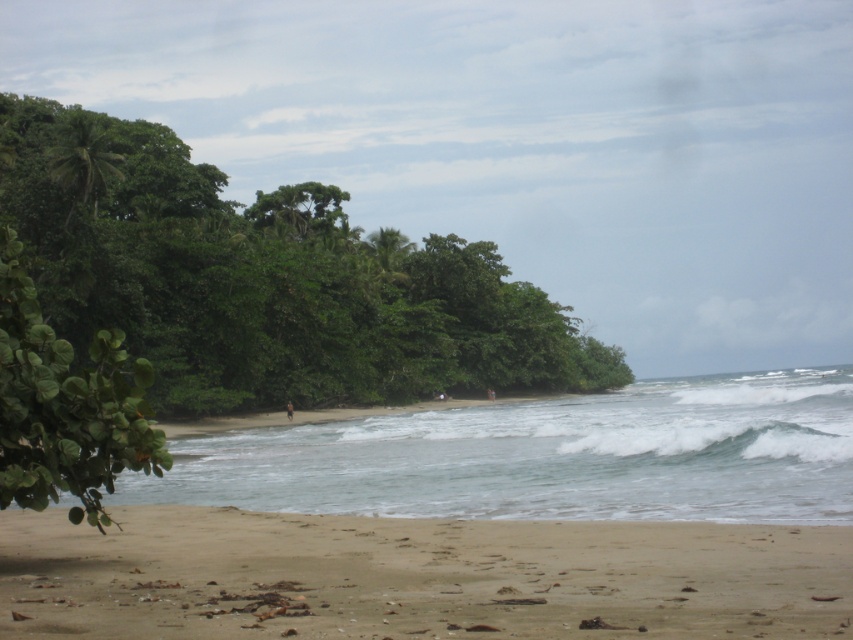
Which of these two, sandy beach at lower center or clear blue water at center, stands shorter?

With less height is sandy beach at lower center.

Where is `sandy beach at lower center`? The width and height of the screenshot is (853, 640). sandy beach at lower center is located at coordinates (415, 577).

The image size is (853, 640). Identify the location of sandy beach at lower center. (415, 577).

Between point (321, 500) and point (36, 484), which one is positioned behind?

The point (321, 500) is more distant.

Describe the element at coordinates (548, 456) in the screenshot. The width and height of the screenshot is (853, 640). I see `clear blue water at center` at that location.

Locate an element on the screen. Image resolution: width=853 pixels, height=640 pixels. clear blue water at center is located at coordinates (548, 456).

Which is above, green leafy trees at left or clear blue water at center?

green leafy trees at left is higher up.

Is green leafy trees at left shorter than clear blue water at center?

Incorrect, green leafy trees at left's height does not fall short of clear blue water at center's.

Between point (541, 298) and point (656, 468), which one is positioned behind?

The point (541, 298) is behind.

This screenshot has height=640, width=853. In order to click on green leafy trees at left in this screenshot , I will do `click(264, 280)`.